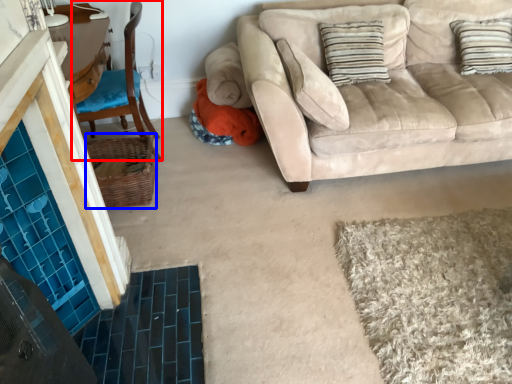
Question: Which object is further to the camera taking this photo, chair (highlighted by a red box) or basket (highlighted by a blue box)?

Choices:
 (A) chair
 (B) basket

Answer: (B)